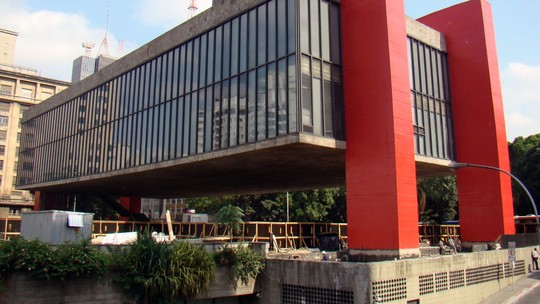
Where is `top set of windows between red posts`? The width and height of the screenshot is (540, 304). top set of windows between red posts is located at coordinates (424, 68).